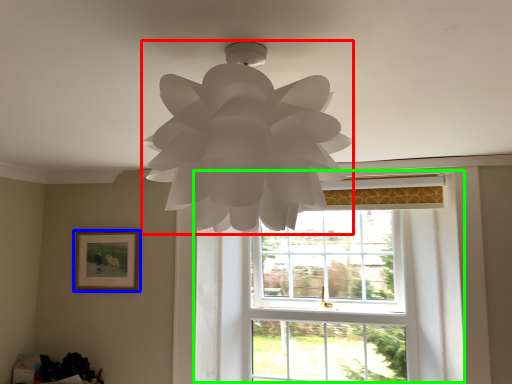
Question: Which object is positioned farthest from lamp (highlighted by a red box)? Select from picture frame (highlighted by a blue box) and window (highlighted by a green box).

Choices:
 (A) picture frame
 (B) window

Answer: (A)